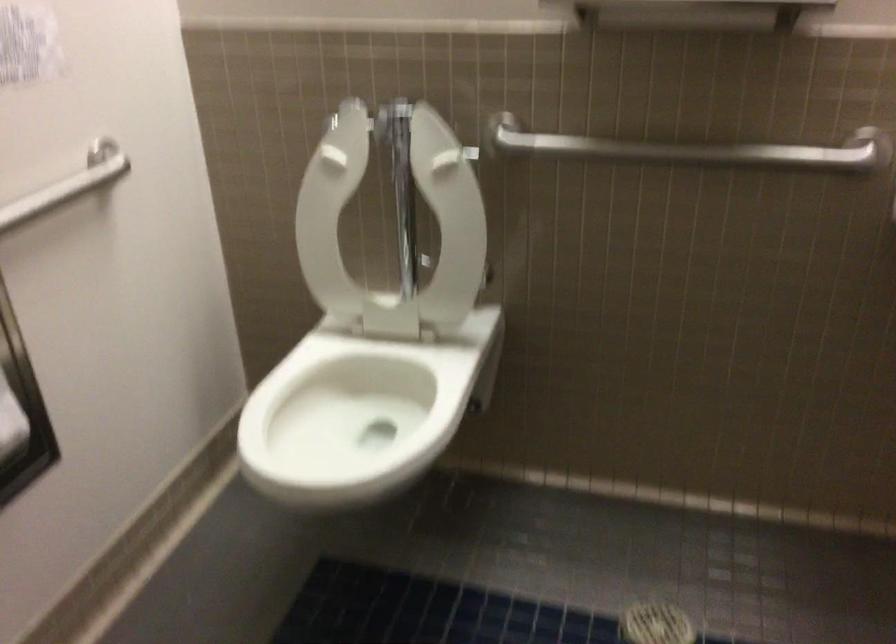
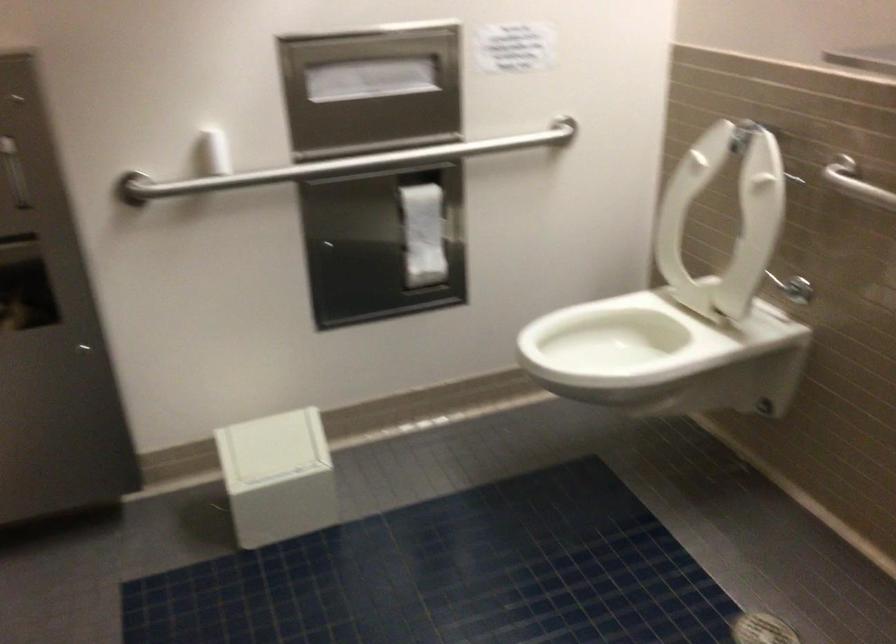
In the second image, find the point that corresponds to (478,272) in the first image.

(793, 288)